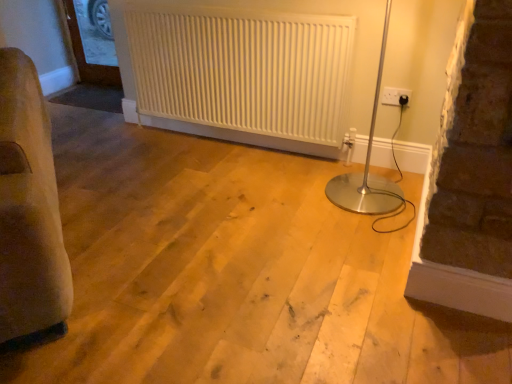
Question: From the image's perspective, is white plastic electric outlet at upper right located above clear glass door at upper left?

Choices:
 (A) no
 (B) yes

Answer: (A)

Question: Is white plastic electric outlet at upper right thinner than clear glass door at upper left?

Choices:
 (A) no
 (B) yes

Answer: (B)

Question: Is white plastic electric outlet at upper right positioned behind clear glass door at upper left?

Choices:
 (A) no
 (B) yes

Answer: (A)

Question: Is white plastic electric outlet at upper right at the right side of clear glass door at upper left?

Choices:
 (A) no
 (B) yes

Answer: (B)

Question: Is white plastic electric outlet at upper right taller than clear glass door at upper left?

Choices:
 (A) no
 (B) yes

Answer: (A)

Question: Does white plastic electric outlet at upper right have a smaller size compared to clear glass door at upper left?

Choices:
 (A) no
 (B) yes

Answer: (B)

Question: From the image's perspective, would you say white plastic electric outlet at upper right is positioned over white textured radiator at center?

Choices:
 (A) no
 (B) yes

Answer: (A)

Question: Could you tell me if white plastic electric outlet at upper right is facing white textured radiator at center?

Choices:
 (A) yes
 (B) no

Answer: (B)

Question: Is white plastic electric outlet at upper right positioned behind white textured radiator at center?

Choices:
 (A) no
 (B) yes

Answer: (B)

Question: Is white plastic electric outlet at upper right beside white textured radiator at center?

Choices:
 (A) no
 (B) yes

Answer: (A)

Question: Does white plastic electric outlet at upper right appear on the right side of white textured radiator at center?

Choices:
 (A) yes
 (B) no

Answer: (A)

Question: Is white plastic electric outlet at upper right positioned with its back to white textured radiator at center?

Choices:
 (A) no
 (B) yes

Answer: (A)

Question: Is white textured radiator at center to the right of clear glass door at upper left from the viewer's perspective?

Choices:
 (A) yes
 (B) no

Answer: (A)